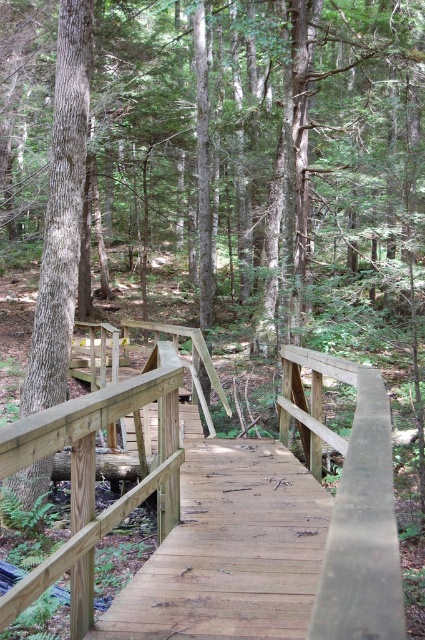
You are a hiker standing at the smooth brown tree trunk at left and want to reach the wooden bridge at center. Which direction should you walk to get there?

The wooden bridge at center is to the right of the smooth brown tree trunk at left, so you should walk to the right to reach it.

You are standing at the camera position and want to reach point (319, 582). Can you walk there without any obstacles?

The distance between you and point (319, 582) is 1.41 meters, so yes, you can walk there without any obstacles as there are no mentioned barriers in the scene.

You are standing at the entrance of the boardwalk and see the point marked at coordinates (351, 504). What structure does this point most likely indicate?

The point at coordinates (351, 504) corresponds to the wooden bridge at center.